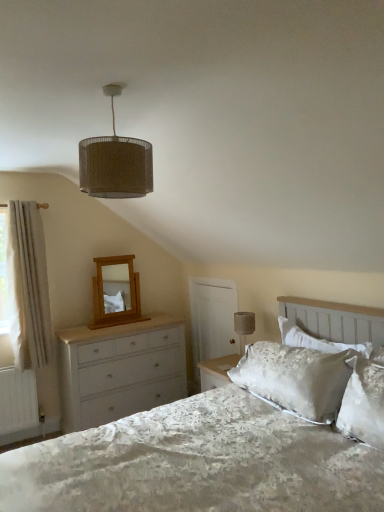
Question: Is silky white pillow at upper right not near white painted wood chest of drawers at left?

Choices:
 (A) no
 (B) yes

Answer: (B)

Question: Does silky white pillow at upper right have a larger size compared to white painted wood chest of drawers at left?

Choices:
 (A) yes
 (B) no

Answer: (B)

Question: Considering the relative sizes of silky white pillow at upper right and white painted wood chest of drawers at left in the image provided, is silky white pillow at upper right wider than white painted wood chest of drawers at left?

Choices:
 (A) no
 (B) yes

Answer: (A)

Question: Can you confirm if silky white pillow at upper right is thinner than white painted wood chest of drawers at left?

Choices:
 (A) no
 (B) yes

Answer: (B)

Question: From a real-world perspective, is silky white pillow at upper right under white painted wood chest of drawers at left?

Choices:
 (A) yes
 (B) no

Answer: (B)

Question: Is burlap lampshade at upper center bigger or smaller than white satin bed at center?

Choices:
 (A) small
 (B) big

Answer: (A)

Question: Is burlap lampshade at upper center wider or thinner than white satin bed at center?

Choices:
 (A) wide
 (B) thin

Answer: (B)

Question: Based on their positions, is burlap lampshade at upper center located to the left or right of white satin bed at center?

Choices:
 (A) left
 (B) right

Answer: (A)

Question: Is burlap lampshade at upper center in front of or behind white satin bed at center in the image?

Choices:
 (A) behind
 (B) front

Answer: (A)

Question: Is white painted wood chest of drawers at left situated inside matte gray fabric at upper right or outside?

Choices:
 (A) outside
 (B) inside

Answer: (A)

Question: From the image's perspective, is white painted wood chest of drawers at left located above or below matte gray fabric at upper right?

Choices:
 (A) below
 (B) above

Answer: (A)

Question: Does point (66, 419) appear closer or farther from the camera than point (253, 312)?

Choices:
 (A) farther
 (B) closer

Answer: (A)

Question: From a real-world perspective, is white painted wood chest of drawers at left positioned above or below matte gray fabric at upper right?

Choices:
 (A) below
 (B) above

Answer: (A)

Question: Is light oak wooden mirror at upper left inside the boundaries of matte gray fabric at upper right, or outside?

Choices:
 (A) inside
 (B) outside

Answer: (B)

Question: From the image's perspective, relative to matte gray fabric at upper right, is light oak wooden mirror at upper left above or below?

Choices:
 (A) above
 (B) below

Answer: (A)